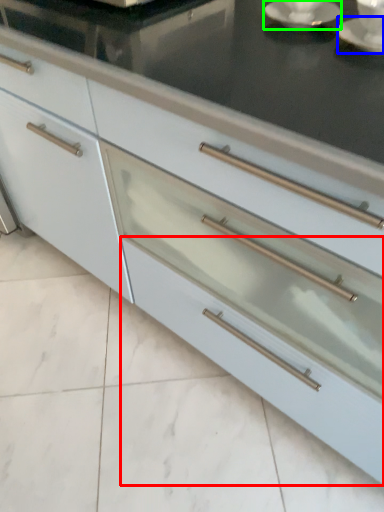
Question: Based on their relative distances, which object is nearer to drawer (highlighted by a red box)? Choose from saucer (highlighted by a blue box) and saucer (highlighted by a green box).

Choices:
 (A) saucer
 (B) saucer

Answer: (A)